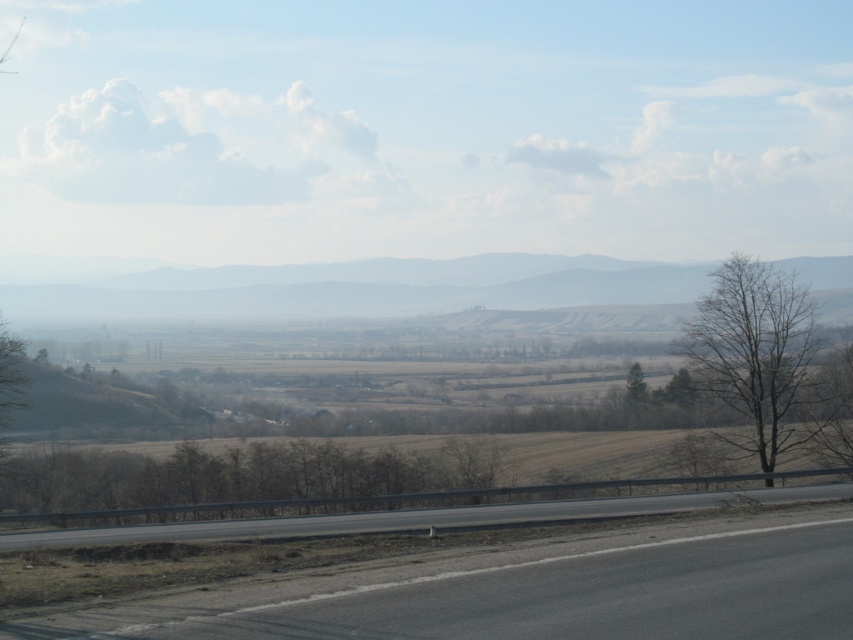
Question: Considering the real-world distances, which object is closest to the brown matte tree at center?

Choices:
 (A) smooth asphalt highway at center
 (B) black asphalt highway at lower center
 (C) bare wood tree at right

Answer: (A)

Question: Is black asphalt highway at lower center to the right of bare wood tree at right from the viewer's perspective?

Choices:
 (A) no
 (B) yes

Answer: (A)

Question: Which object is closer to the camera taking this photo?

Choices:
 (A) black asphalt highway at lower center
 (B) bare wood tree at right

Answer: (A)

Question: Is black asphalt highway at lower center bigger than smooth asphalt highway at center?

Choices:
 (A) yes
 (B) no

Answer: (B)

Question: In this image, where is bare wood tree at right located relative to smooth asphalt highway at center?

Choices:
 (A) right
 (B) left

Answer: (A)

Question: Estimate the real-world distances between objects in this image. Which object is farther from the foggy haze mountain at center?

Choices:
 (A) smooth asphalt highway at center
 (B) brown matte tree at center
 (C) bare wood tree at right

Answer: (C)